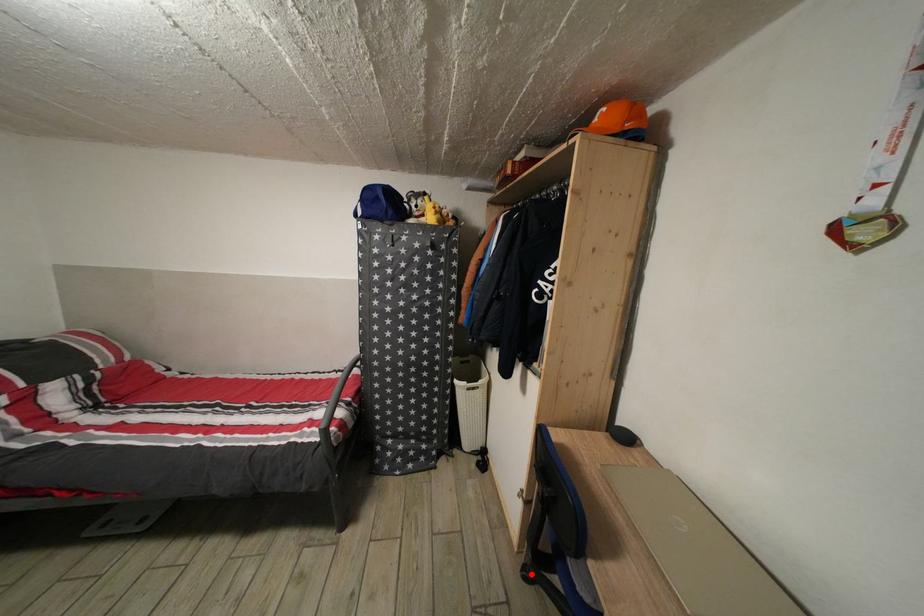
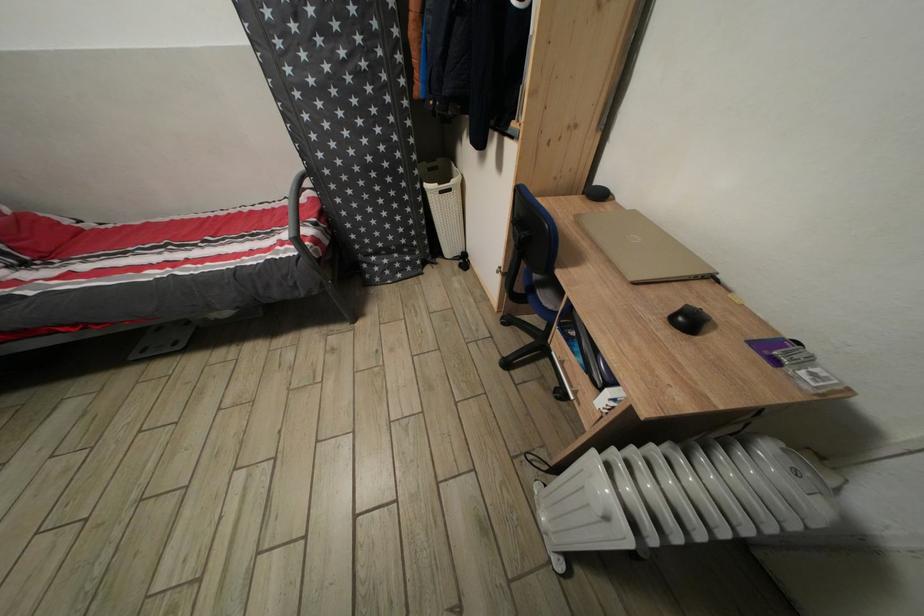
Question: I am providing you with two images of the same scene from different viewpoints. Given a red point in image1, look at the same physical point in image2. Is it:

Choices:
 (A) Closer to the viewpoint
 (B) Farther from the viewpoint

Answer: (A)